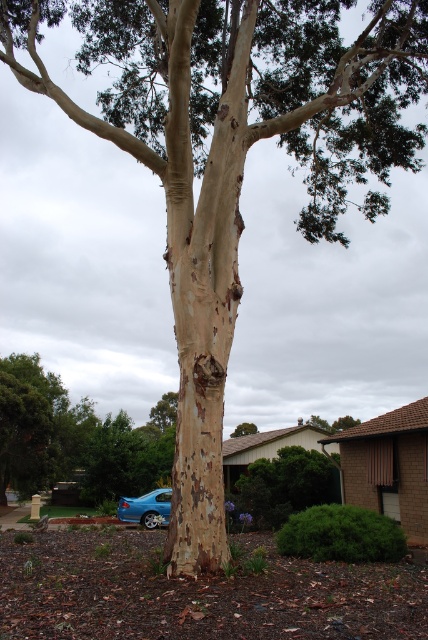
Question: Among these objects, which one is nearest to the camera?

Choices:
 (A) blue metallic sedan at lower left
 (B) smooth bark tree at center

Answer: (A)

Question: Does blue metallic sedan at lower left have a smaller size compared to smooth bark tree at center?

Choices:
 (A) yes
 (B) no

Answer: (A)

Question: Is blue metallic sedan at lower left closer to the viewer compared to smooth bark tree at center?

Choices:
 (A) yes
 (B) no

Answer: (A)

Question: Among these points, which one is nearest to the camera?

Choices:
 (A) (232, 436)
 (B) (168, 522)

Answer: (B)

Question: Among these objects, which one is nearest to the camera?

Choices:
 (A) smooth bark tree at center
 (B) blue metallic sedan at lower left

Answer: (B)

Question: Is blue metallic sedan at lower left to the right of smooth bark tree at center from the viewer's perspective?

Choices:
 (A) no
 (B) yes

Answer: (A)